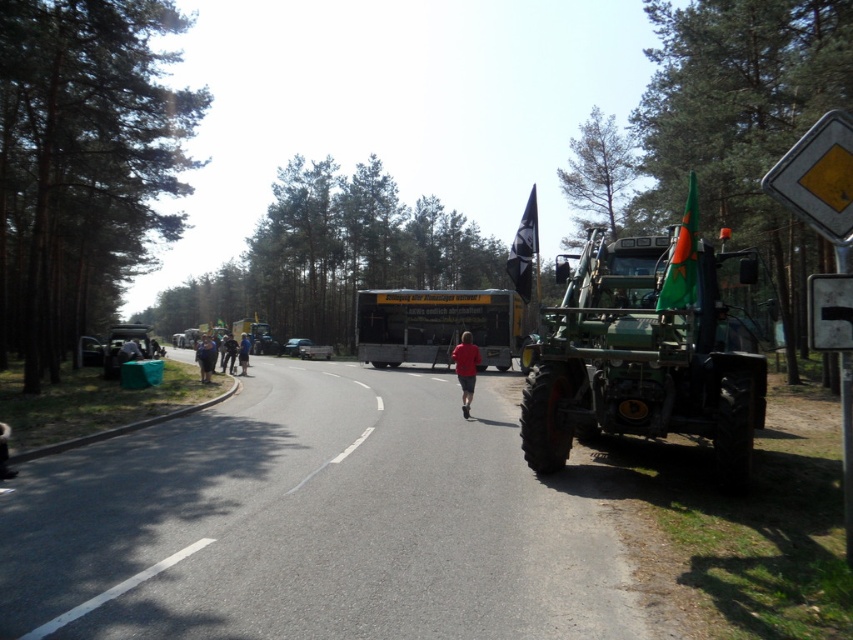
You are a delivery driver trying to navigate through the rural road scene. You notice the metallic silver trailer at left and the dark blue fabric jacket at center. Which object is taller?

The metallic silver trailer at left is taller than the dark blue fabric jacket at center.

You are a delivery driver who needs to pass through this rural road. You see the metallic silver trailer at left and the dark blue fabric jacket at center. Which object is bigger in size?

The metallic silver trailer at left is larger in size compared to the dark blue fabric jacket at center.

You are a pedestrian standing on the rural road and want to cross to the other side. There is a metallic silver trailer at left and a dark blue fabric jacket at center. Which object is closer to you?

The metallic silver trailer at left is closer to the viewer than the dark blue fabric jacket at center, so the metallic silver trailer at left is closer to you.